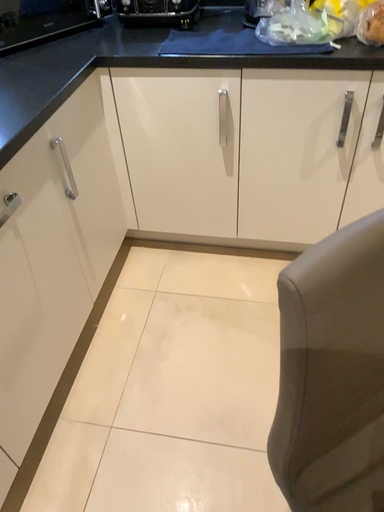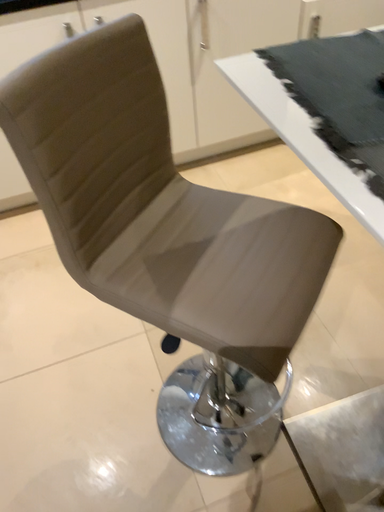
Question: How did the camera likely rotate when shooting the video?

Choices:
 (A) rotated right
 (B) rotated left

Answer: (A)